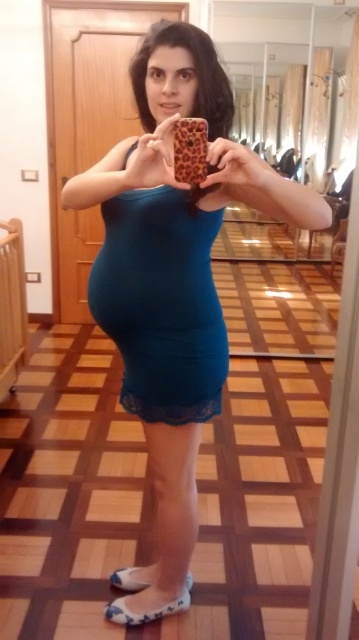
Is teal fabric dress at center closer to camera compared to white fabric sandal at lower center?

Yes, teal fabric dress at center is closer to the viewer.

Is point (206, 385) positioned after point (132, 588)?

No.

What do you see at coordinates (174, 273) in the screenshot? Image resolution: width=359 pixels, height=640 pixels. I see `teal fabric dress at center` at bounding box center [174, 273].

Identify the location of teal fabric dress at center. (174, 273).

Who is lower down, teal fabric dress at center or teal matte dress at center?

Positioned lower is teal fabric dress at center.

Who is more forward, (220, 387) or (100, 300)?

Point (100, 300) is in front.

This screenshot has width=359, height=640. What do you see at coordinates (174, 273) in the screenshot?
I see `teal fabric dress at center` at bounding box center [174, 273].

Where is `teal fabric dress at center`? This screenshot has height=640, width=359. teal fabric dress at center is located at coordinates (174, 273).

You are a GUI agent. You are given a task and a screenshot of the screen. Output one action in this format:
    pyautogui.click(x=<x>, y=<y>)
    Task: Click on the blue fabric sandal at lower center
    
    Given the screenshot: What is the action you would take?
    tap(150, 609)

Between point (171, 605) and point (118, 570), which one is positioned in front?

Point (171, 605) is more forward.

At what (x,y) coordinates should I click in order to perform the action: click on blue fabric sandal at lower center. Please return your answer as a coordinate pair (x, y). The image size is (359, 640). Looking at the image, I should click on (150, 609).